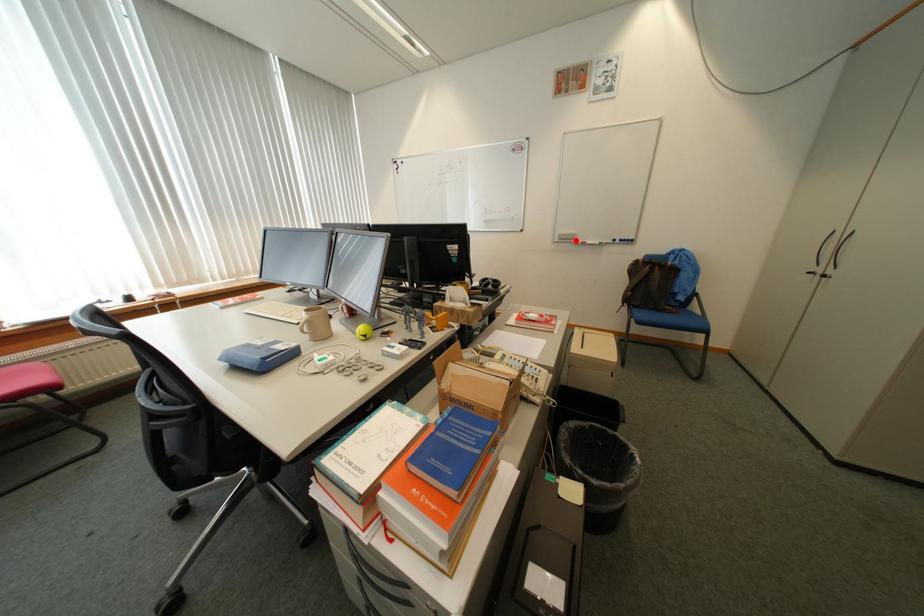
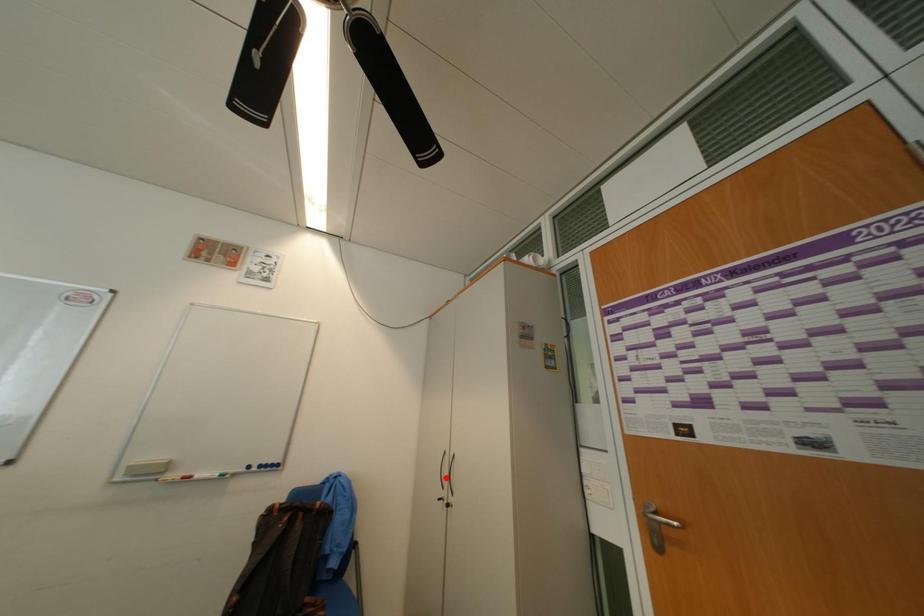
I am providing you with two images of the same scene from different viewpoints. A red point is marked on the first image and another point is marked on the second image. Does the point marked in image1 correspond to the same location as the one in image2?

No